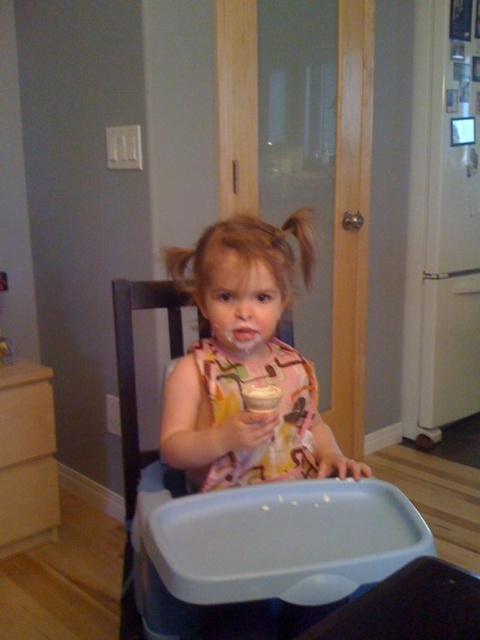
Question: Is matte pink dress at center to the left of printed fabric bib at center from the viewer's perspective?

Choices:
 (A) yes
 (B) no

Answer: (A)

Question: Considering the relative positions of matte pink dress at center and printed fabric bib at center in the image provided, where is matte pink dress at center located with respect to printed fabric bib at center?

Choices:
 (A) below
 (B) above

Answer: (B)

Question: Can you confirm if matte pink dress at center is positioned to the right of printed fabric bib at center?

Choices:
 (A) yes
 (B) no

Answer: (B)

Question: Which of the following is the closest to the observer?

Choices:
 (A) printed fabric bib at center
 (B) matte pink dress at center

Answer: (B)

Question: Among these objects, which one is nearest to the camera?

Choices:
 (A) printed fabric bib at center
 (B) matte pink dress at center

Answer: (B)

Question: Which of the following is the closest to the observer?

Choices:
 (A) printed fabric bib at center
 (B) matte pink dress at center

Answer: (B)